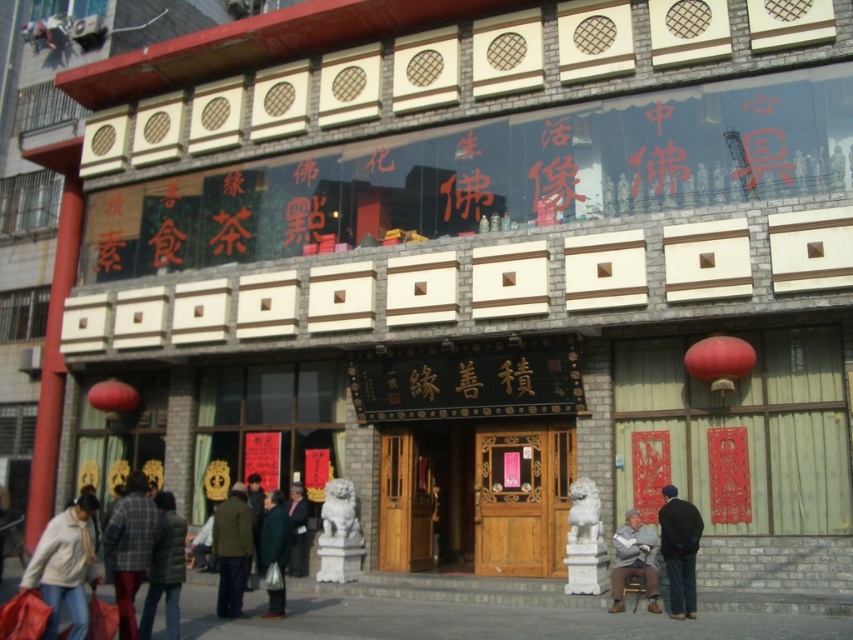
Question: Which of the following is the closest to the observer?

Choices:
 (A) (695, 509)
 (B) (624, 564)
 (C) (532, 481)

Answer: (A)

Question: Can you confirm if plaid fabric jacket at lower left is wider than gray wool sweater at lower right?

Choices:
 (A) no
 (B) yes

Answer: (B)

Question: Which point is farther to the camera?

Choices:
 (A) (660, 518)
 (B) (651, 560)
 (C) (122, 499)
 (D) (53, 566)

Answer: (B)

Question: Is plaid fabric jacket at lower left closer to camera compared to dark gray coat at center?

Choices:
 (A) no
 (B) yes

Answer: (B)

Question: Which object is farther from the camera taking this photo?

Choices:
 (A) dark green jacket at lower left
 (B) white cotton jacket at lower left
 (C) plaid fabric jacket at lower left
 (D) dark gray fabric coat at lower center

Answer: (A)

Question: Is dark gray fabric coat at lower right below gray wool sweater at lower right?

Choices:
 (A) yes
 (B) no

Answer: (B)